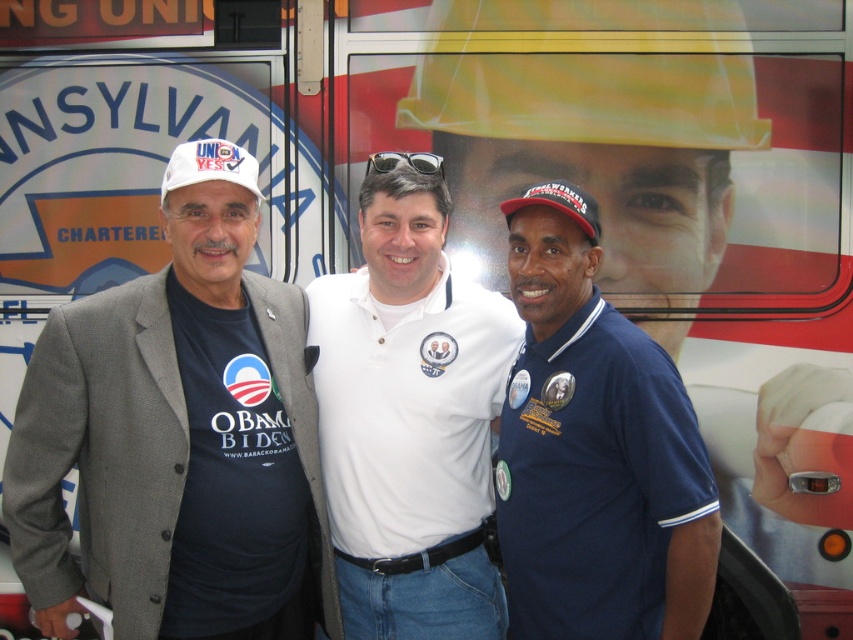
Question: Based on their relative distances, which object is farther from the red fabric baseball cap at center?

Choices:
 (A) white matte baseball hat at left
 (B) white cotton polo shirt at center
 (C) gray wool blazer at left

Answer: (C)

Question: Can you confirm if navy blue polo shirt at center is positioned to the right of red fabric baseball cap at center?

Choices:
 (A) yes
 (B) no

Answer: (A)

Question: Which point is closer to the camera?

Choices:
 (A) (299, 529)
 (B) (582, 412)

Answer: (B)

Question: Does gray wool blazer at left come in front of navy blue polo shirt at center?

Choices:
 (A) yes
 (B) no

Answer: (B)

Question: Does white cotton polo shirt at center have a smaller size compared to white matte baseball hat at left?

Choices:
 (A) yes
 (B) no

Answer: (B)

Question: Among these objects, which one is farthest from the camera?

Choices:
 (A) white matte baseball hat at left
 (B) gray wool blazer at left

Answer: (A)